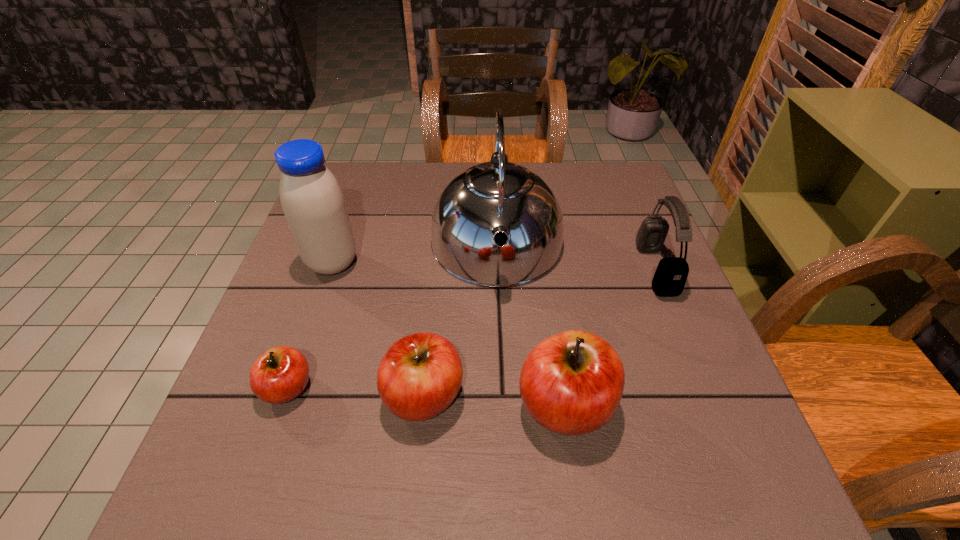
Identify the location of object present at the near left corner. Image resolution: width=960 pixels, height=540 pixels. (281, 374).

Identify the location of vacant region at the far edge of the desktop. This screenshot has height=540, width=960. (431, 168).

This screenshot has height=540, width=960. I want to click on vacant space at the left edge of the desktop, so click(x=253, y=343).

Locate an element on the screen. The width and height of the screenshot is (960, 540). vacant region at the right edge of the desktop is located at coordinates click(708, 372).

This screenshot has width=960, height=540. In order to click on free spot at the far left corner of the desktop in this screenshot , I will do `click(359, 168)`.

In the image, there is a desktop. Where is `vacant space at the near left corner`? The height and width of the screenshot is (540, 960). vacant space at the near left corner is located at coordinates (291, 419).

Identify the location of vacant space at the far right corner. The height and width of the screenshot is (540, 960). (599, 178).

Locate an element on the screen. The width and height of the screenshot is (960, 540). unoccupied position between the leftmost apple and the rightmost object is located at coordinates (471, 328).

At what (x,y) coordinates should I click in order to perform the action: click on free spot between the headset and the rightmost apple. Please return your answer as a coordinate pair (x, y). The height and width of the screenshot is (540, 960). Looking at the image, I should click on (611, 337).

What are the coordinates of `vacant point located between the shortest object and the kettle` in the screenshot? It's located at (392, 316).